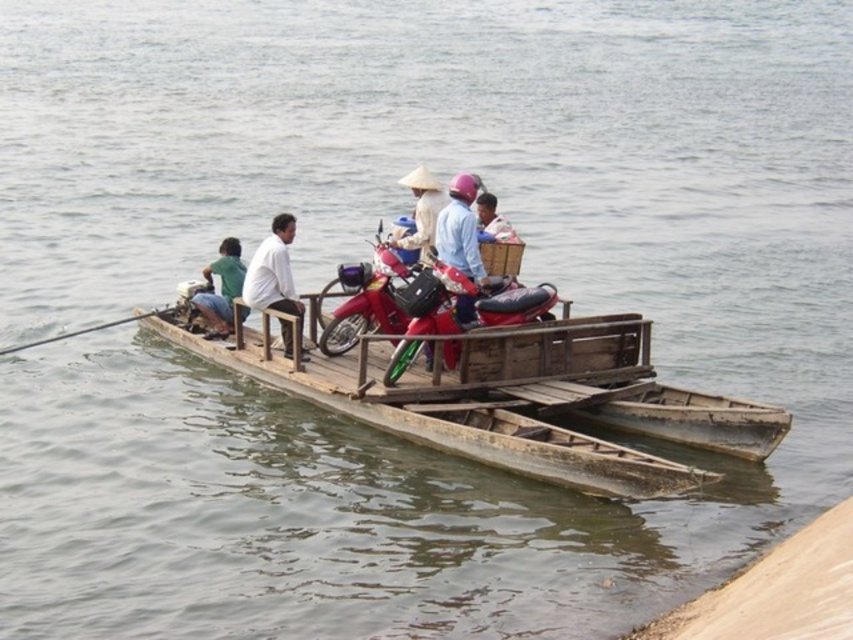
Who is taller, metallic red motorcycle at center or light brown wooden basket at center?

metallic red motorcycle at center

Does metallic red motorcycle at center have a smaller size compared to light brown wooden basket at center?

Incorrect, metallic red motorcycle at center is not smaller in size than light brown wooden basket at center.

Describe the element at coordinates (469, 300) in the screenshot. I see `metallic red motorcycle at center` at that location.

Find the location of a particular element. metallic red motorcycle at center is located at coordinates (469, 300).

Which is above, shiny red motorcycle at center or light brown wooden basket at center?

Positioned higher is light brown wooden basket at center.

Who is more forward, (379,225) or (498,230)?

Point (498,230) is more forward.

Locate an element on the screen. The width and height of the screenshot is (853, 640). shiny red motorcycle at center is located at coordinates (364, 298).

Between shiny red motorcycle at center and white matte shirt at center, which one has less height?

shiny red motorcycle at center is shorter.

Which of these two, shiny red motorcycle at center or white matte shirt at center, stands taller?

Standing taller between the two is white matte shirt at center.

At what (x,y) coordinates should I click in order to perform the action: click on shiny red motorcycle at center. Please return your answer as a coordinate pair (x, y). The image size is (853, 640). Looking at the image, I should click on (364, 298).